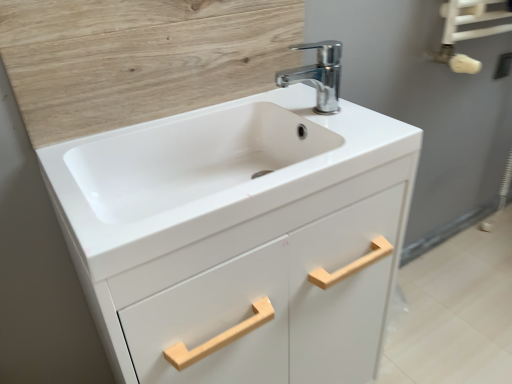
Question: Is white glossy towel rack at upper right next to white matte cabinet at center?

Choices:
 (A) no
 (B) yes

Answer: (A)

Question: Can you confirm if white glossy towel rack at upper right is thinner than white matte cabinet at center?

Choices:
 (A) no
 (B) yes

Answer: (B)

Question: From a real-world perspective, is white glossy towel rack at upper right on top of white matte cabinet at center?

Choices:
 (A) no
 (B) yes

Answer: (B)

Question: From the image's perspective, would you say white glossy towel rack at upper right is shown under white matte cabinet at center?

Choices:
 (A) yes
 (B) no

Answer: (B)

Question: Is the depth of white glossy towel rack at upper right greater than that of white matte cabinet at center?

Choices:
 (A) no
 (B) yes

Answer: (B)

Question: Based on their sizes in the image, would you say chrome metallic faucet at upper center is bigger or smaller than wooden panel at upper left?

Choices:
 (A) small
 (B) big

Answer: (A)

Question: Is chrome metallic faucet at upper center wider or thinner than wooden panel at upper left?

Choices:
 (A) thin
 (B) wide

Answer: (B)

Question: Visually, is chrome metallic faucet at upper center positioned to the left or to the right of wooden panel at upper left?

Choices:
 (A) right
 (B) left

Answer: (A)

Question: From the image's perspective, is chrome metallic faucet at upper center located above or below wooden panel at upper left?

Choices:
 (A) below
 (B) above

Answer: (A)

Question: Is white glossy sink at center wider or thinner than white matte cabinet at center?

Choices:
 (A) wide
 (B) thin

Answer: (B)

Question: From a real-world perspective, is white glossy sink at center above or below white matte cabinet at center?

Choices:
 (A) above
 (B) below

Answer: (A)

Question: Based on their positions, is white glossy sink at center located to the left or right of white matte cabinet at center?

Choices:
 (A) right
 (B) left

Answer: (B)

Question: Considering their positions, is white glossy sink at center located in front of or behind white matte cabinet at center?

Choices:
 (A) behind
 (B) front

Answer: (A)

Question: Is wooden panel at upper left situated inside white glossy towel rack at upper right or outside?

Choices:
 (A) outside
 (B) inside

Answer: (A)

Question: Looking at their shapes, would you say wooden panel at upper left is wider or thinner than white glossy towel rack at upper right?

Choices:
 (A) wide
 (B) thin

Answer: (B)